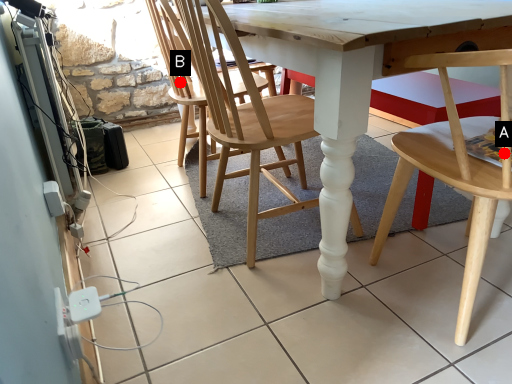
Question: Two points are circled on the image, labeled by A and B beside each circle. Which point is closer to the camera?

Choices:
 (A) A is closer
 (B) B is closer

Answer: (A)